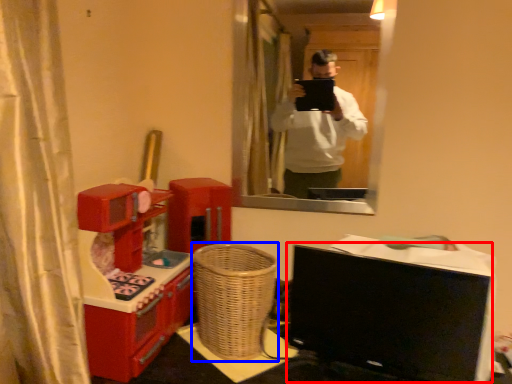
Question: Which object appears closest to the camera in this image, computer monitor (highlighted by a red box) or basket (highlighted by a blue box)?

Choices:
 (A) computer monitor
 (B) basket

Answer: (A)